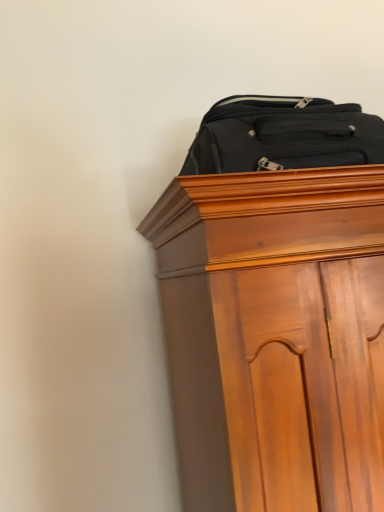
What is the approximate height of matte black suitcase at upper right?

matte black suitcase at upper right is 6.78 inches tall.

This screenshot has height=512, width=384. Describe the element at coordinates (283, 135) in the screenshot. I see `matte black suitcase at upper right` at that location.

Where is `matte black suitcase at upper right`? The image size is (384, 512). matte black suitcase at upper right is located at coordinates (283, 135).

Locate an element on the screen. The image size is (384, 512). matte black suitcase at upper right is located at coordinates (283, 135).